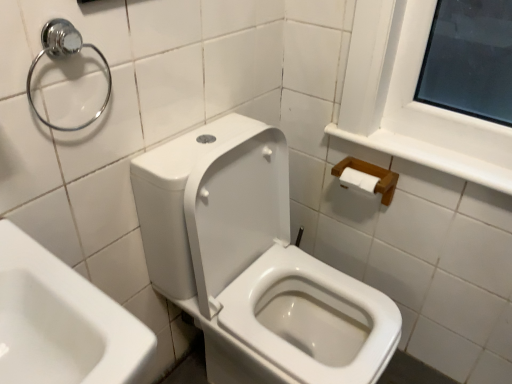
Question: Should I look upward or downward to see chrome metallic towel ring at upper left?

Choices:
 (A) down
 (B) up

Answer: (B)

Question: Considering the relative sizes of white glossy toilet at center and wooden tissue holder at upper right in the image provided, is white glossy toilet at center thinner than wooden tissue holder at upper right?

Choices:
 (A) no
 (B) yes

Answer: (A)

Question: Is white glossy toilet at center at the right side of wooden tissue holder at upper right?

Choices:
 (A) yes
 (B) no

Answer: (B)

Question: From the image's perspective, does white glossy toilet at center appear higher than wooden tissue holder at upper right?

Choices:
 (A) no
 (B) yes

Answer: (A)

Question: Would you consider white glossy toilet at center to be distant from wooden tissue holder at upper right?

Choices:
 (A) no
 (B) yes

Answer: (A)

Question: Is white glossy toilet at center bigger than wooden tissue holder at upper right?

Choices:
 (A) no
 (B) yes

Answer: (B)

Question: Is white glossy toilet at center shorter than wooden tissue holder at upper right?

Choices:
 (A) no
 (B) yes

Answer: (A)

Question: Is wooden tissue holder at upper right at the right side of chrome metallic towel ring at upper left?

Choices:
 (A) no
 (B) yes

Answer: (B)

Question: Is wooden tissue holder at upper right positioned with its back to chrome metallic towel ring at upper left?

Choices:
 (A) yes
 (B) no

Answer: (B)

Question: Is wooden tissue holder at upper right completely or partially outside of chrome metallic towel ring at upper left?

Choices:
 (A) yes
 (B) no

Answer: (A)

Question: Does wooden tissue holder at upper right have a greater height compared to chrome metallic towel ring at upper left?

Choices:
 (A) no
 (B) yes

Answer: (A)

Question: From a real-world perspective, is wooden tissue holder at upper right beneath chrome metallic towel ring at upper left?

Choices:
 (A) yes
 (B) no

Answer: (A)

Question: Is wooden tissue holder at upper right bigger than chrome metallic towel ring at upper left?

Choices:
 (A) yes
 (B) no

Answer: (A)

Question: Does white glossy toilet at center contain chrome metallic towel ring at upper left?

Choices:
 (A) yes
 (B) no

Answer: (B)